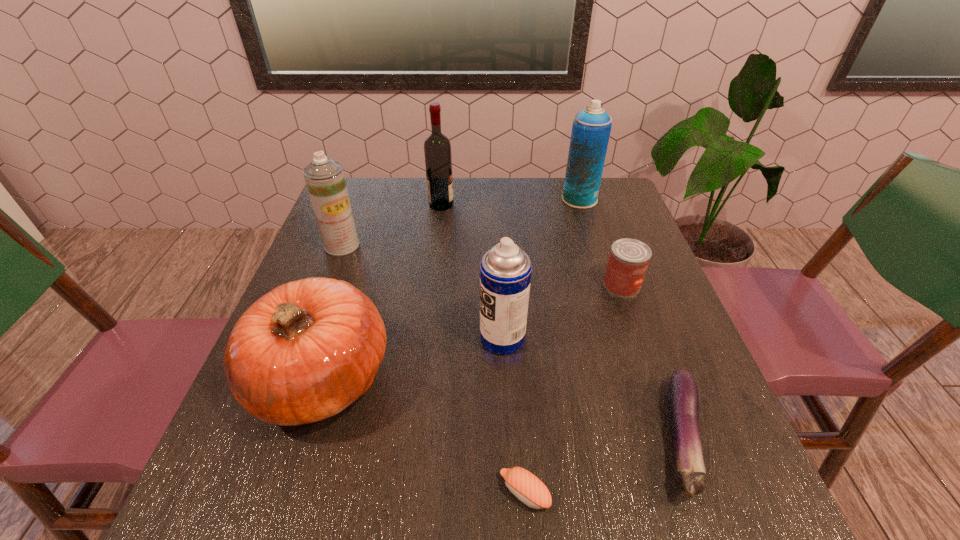
Find the location of a particular element. The width and height of the screenshot is (960, 540). alcohol present at the far edge is located at coordinates (437, 149).

Where is `aerosol can situated at the far edge`? The width and height of the screenshot is (960, 540). aerosol can situated at the far edge is located at coordinates (591, 128).

I want to click on eggplant at the near edge, so click(683, 404).

The image size is (960, 540). I want to click on sushi that is at the near edge, so (x=529, y=489).

Identify the location of aerosol can located in the left edge section of the desktop. Image resolution: width=960 pixels, height=540 pixels. (324, 177).

You are a GUI agent. You are given a task and a screenshot of the screen. Output one action in this format:
    pyautogui.click(x=<x>, y=<y>)
    Task: Click on the pumpkin positioned at the left edge
    
    Given the screenshot: What is the action you would take?
    pyautogui.click(x=305, y=351)

Where is `aerosol can at the right edge`? The height and width of the screenshot is (540, 960). aerosol can at the right edge is located at coordinates (591, 128).

Find the location of a particular element. This screenshot has height=540, width=960. can that is at the right edge is located at coordinates tap(628, 261).

Find the location of a particular element. This screenshot has height=540, width=960. eggplant at the right edge is located at coordinates (683, 404).

Locate an element on the screen. This screenshot has width=960, height=540. object located in the far right corner section of the desktop is located at coordinates (591, 128).